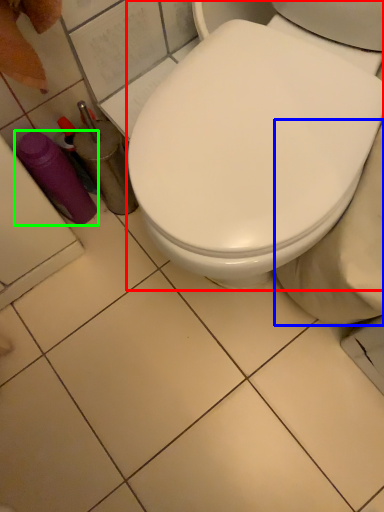
Question: Which object is positioned closest to toilet (highlighted by a red box)? Select from bidet (highlighted by a blue box) and bottle (highlighted by a green box).

Choices:
 (A) bidet
 (B) bottle

Answer: (A)